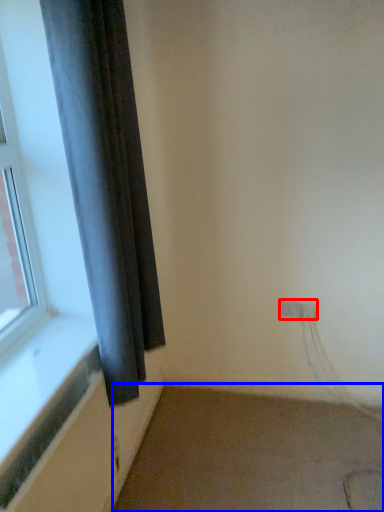
Question: Which of the following is the farthest to the observer, electric outlet (highlighted by a red box) or plain (highlighted by a blue box)?

Choices:
 (A) electric outlet
 (B) plain

Answer: (A)